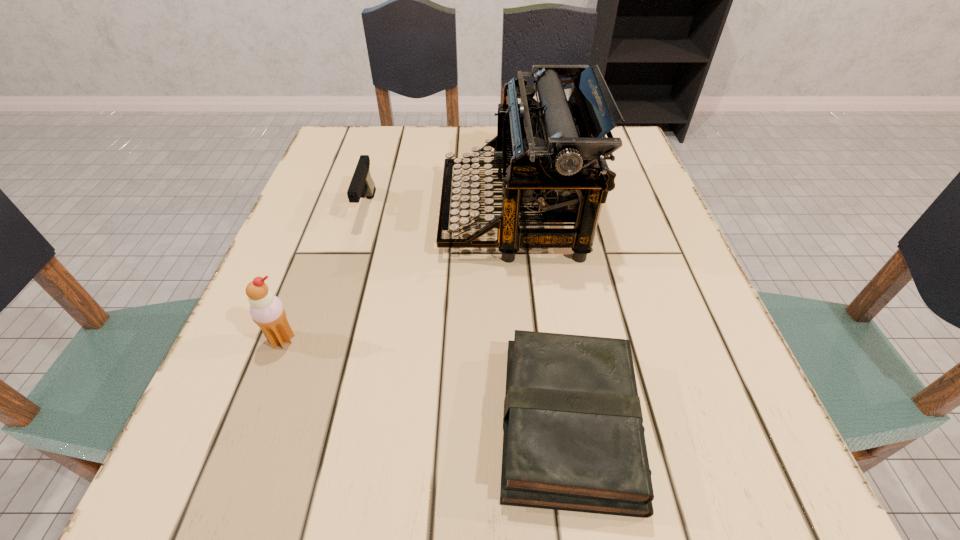
Locate an element on the screen. Image resolution: width=960 pixels, height=540 pixels. blank area in the image that satisfies the following two spatial constraints: 1. on the typing side of the shortest object; 2. on the left side of the tallest object is located at coordinates (531, 423).

I want to click on vacant space that satisfies the following two spatial constraints: 1. at the front with a straw on the icecream; 2. on the right side of the shortest object, so click(251, 423).